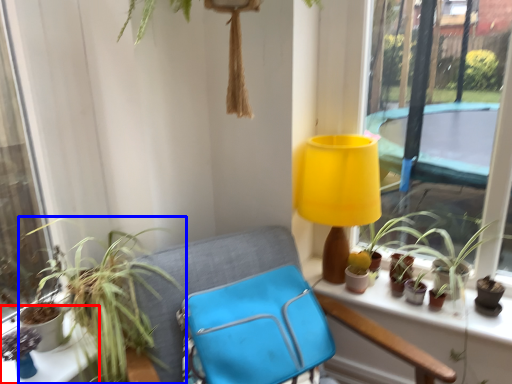
Question: Which of the following is the closest to the observer, table (highlighted by a red box) or houseplant (highlighted by a blue box)?

Choices:
 (A) table
 (B) houseplant

Answer: (B)